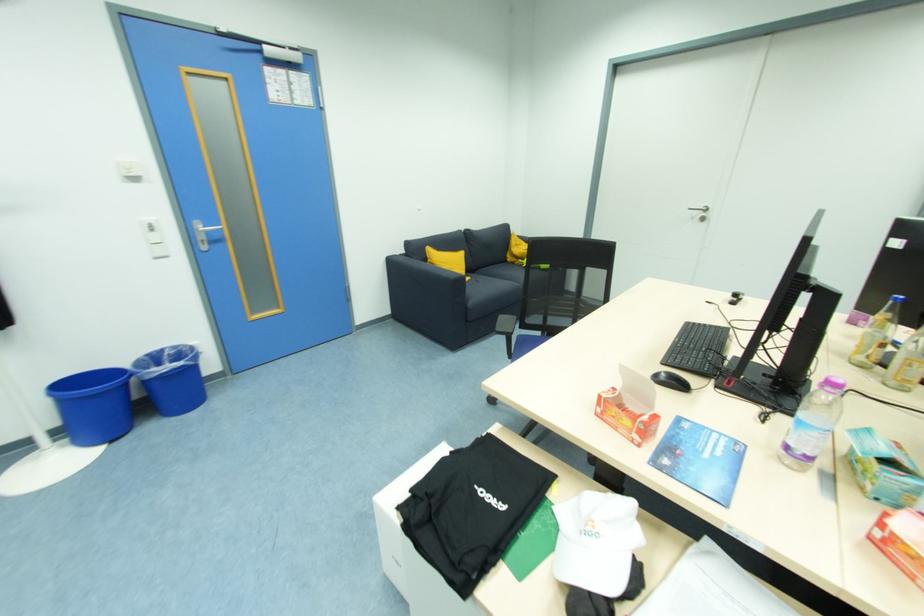
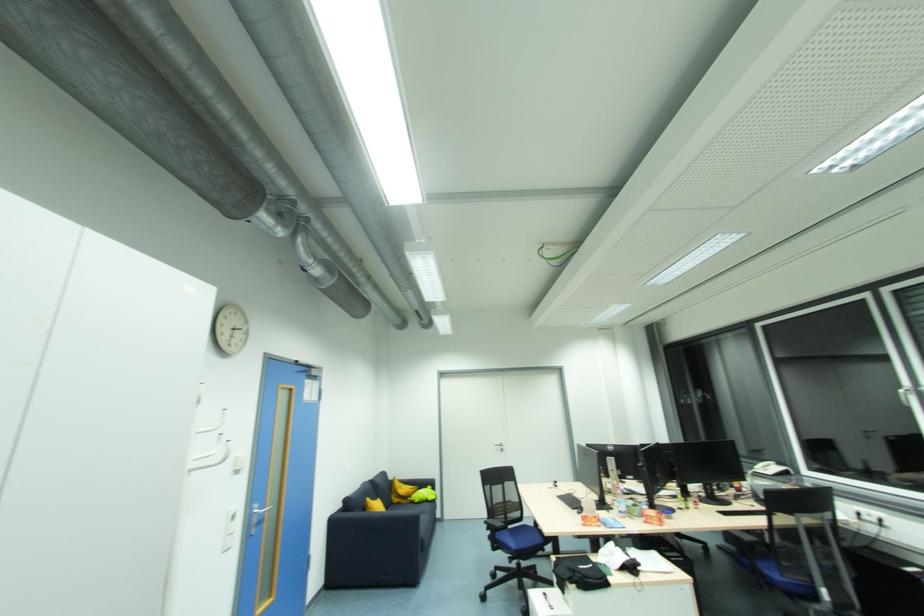
Where in the second image is the point corresponding to the point at 516,265 from the first image?

(400, 505)